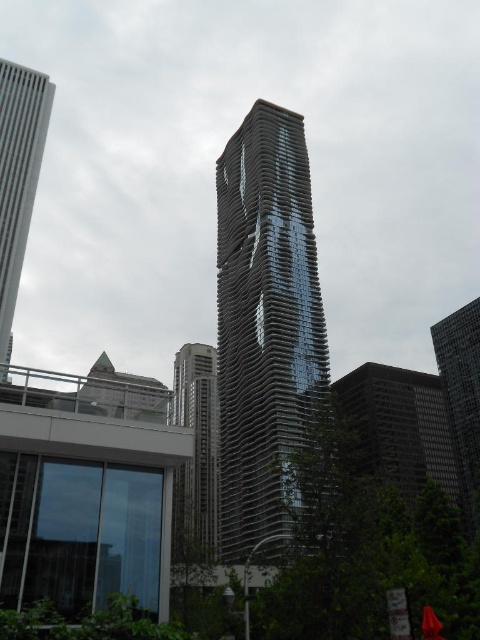
You are standing at the camera position and want to take a photo of the glossy glass tower at center. If your camera has a maximum focus range of 70 feet, will it be able to capture the tower clearly?

The glossy glass tower at center and camera are 69.95 feet apart from each other, which is within the camera maximum focus range of 70 feet. Therefore, the camera can capture the tower clearly.

You are standing at the base of the skyscraper and want to take a photo of the two points marked in the image. Which point, point [271,506] or point [43,140], will appear closer to the camera in your photo?

Point [271,506] will appear closer to the camera in the photo because it is positioned in front of point [43,140].

You are standing in the urban landscape and want to reach a specific location marked by the point at coordinates point (283, 129). If your walking speed is 1.5 meters per second, how many seconds will it take you to reach that point?

The point (283, 129) is 128.03 meters away from the viewer. At a walking speed of 1.5 meters per second, it will take approximately 85.35 seconds to reach the point.